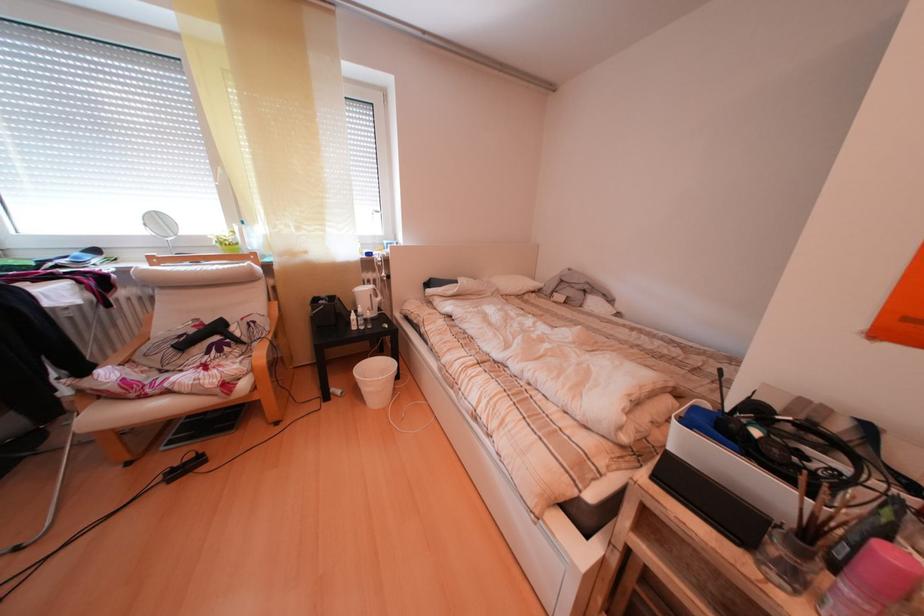
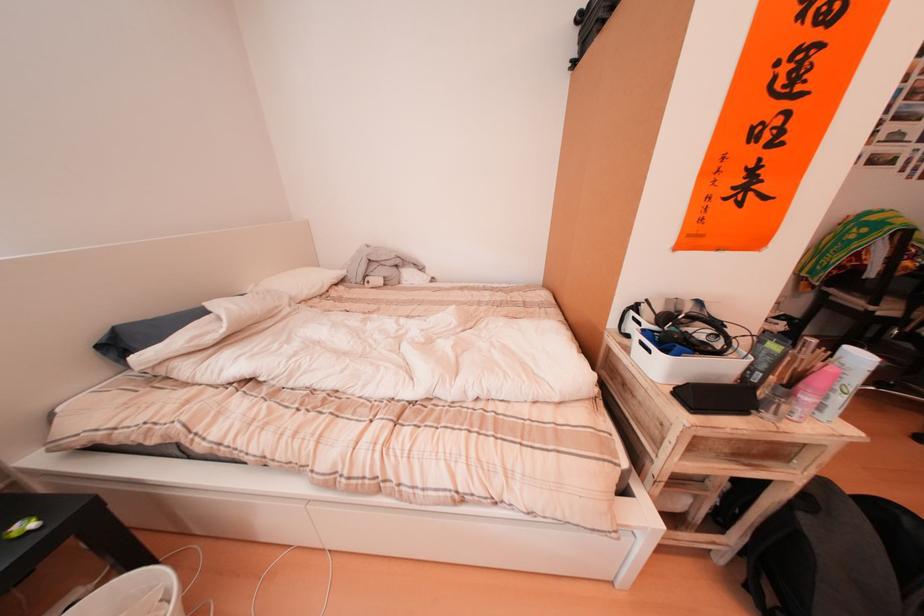
Question: The camera is either moving clockwise (left) or counter-clockwise (right) around the object. The first image is from the beginning of the video and the second image is from the end. Is the camera moving left or right when shooting the video?

Choices:
 (A) Left
 (B) Right

Answer: (A)